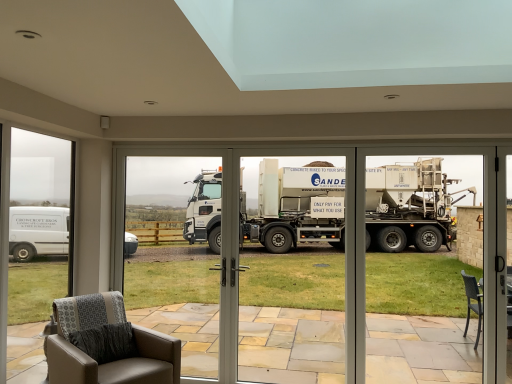
Question: Does transparent glass door at center have a lesser width compared to leather armchair at lower left?

Choices:
 (A) yes
 (B) no

Answer: (A)

Question: Is transparent glass door at center in front of leather armchair at lower left?

Choices:
 (A) no
 (B) yes

Answer: (A)

Question: Considering the relative positions of transparent glass door at center and leather armchair at lower left in the image provided, is transparent glass door at center behind leather armchair at lower left?

Choices:
 (A) yes
 (B) no

Answer: (A)

Question: Can you confirm if transparent glass door at center is bigger than leather armchair at lower left?

Choices:
 (A) yes
 (B) no

Answer: (B)

Question: Is transparent glass door at center aimed at leather armchair at lower left?

Choices:
 (A) no
 (B) yes

Answer: (B)

Question: In the image, is clear glass window at left positioned in front of or behind white matte truck at center, the 2th garage door viewed from the right?

Choices:
 (A) behind
 (B) front

Answer: (B)

Question: From a real-world perspective, is clear glass window at left positioned above or below white matte truck at center, placed as the 1th garage door when sorted from left to right?

Choices:
 (A) below
 (B) above

Answer: (B)

Question: Is clear glass window at left spatially inside white matte truck at center, the 2th garage door viewed from the right, or outside of it?

Choices:
 (A) inside
 (B) outside

Answer: (B)

Question: Is point (41, 317) positioned closer to the camera than point (266, 312)?

Choices:
 (A) farther
 (B) closer

Answer: (B)

Question: Would you say white glossy truck at center, which ranks as the first garage door in right-to-left order, is inside or outside transparent glass door at center?

Choices:
 (A) inside
 (B) outside

Answer: (A)

Question: In terms of width, does white glossy truck at center, which is the second garage door in left-to-right order, look wider or thinner when compared to transparent glass door at center?

Choices:
 (A) thin
 (B) wide

Answer: (B)

Question: In terms of size, does white glossy truck at center, which is the second garage door in left-to-right order, appear bigger or smaller than transparent glass door at center?

Choices:
 (A) big
 (B) small

Answer: (A)

Question: From a real-world perspective, is white glossy truck at center, which is the second garage door in left-to-right order, above or below transparent glass door at center?

Choices:
 (A) above
 (B) below

Answer: (B)

Question: Is white glossy truck at center, which is the second garage door in left-to-right order, wider or thinner than clear glass window at left?

Choices:
 (A) wide
 (B) thin

Answer: (A)

Question: In terms of size, does white glossy truck at center, which ranks as the first garage door in right-to-left order, appear bigger or smaller than clear glass window at left?

Choices:
 (A) big
 (B) small

Answer: (A)